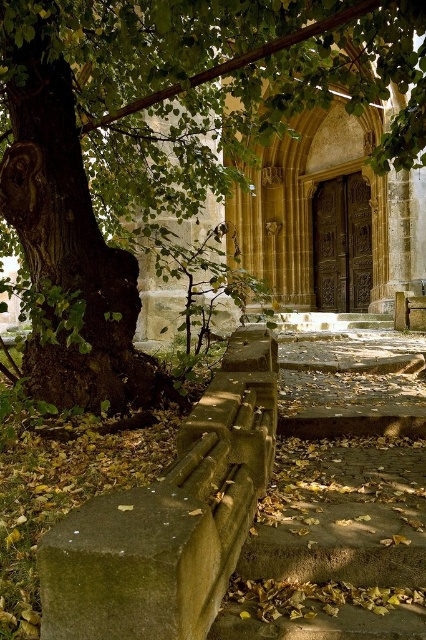
You are standing at the entrance of the historic stone building and looking towards the upper left corner of the image. There is a point marked at coordinates (161, 144). What object does this point correspond to?

The point at coordinates (161, 144) corresponds to the green leafy tree at upper left.

You are standing at the base of the concrete stairs at center and want to look up towards the green leafy tree at upper left. Which direction should you turn your head to see it?

The green leafy tree at upper left is above the concrete stairs at center, so you should look upward and to the left to see it.